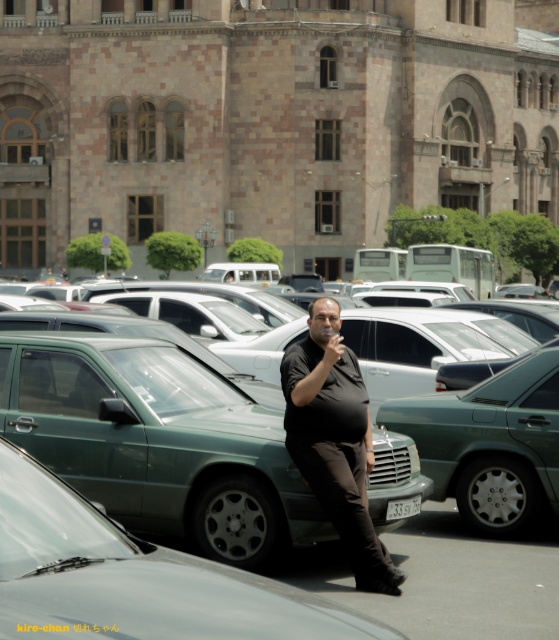
Question: Is black matte shirt at center positioned behind green matte car at center?

Choices:
 (A) yes
 (B) no

Answer: (A)

Question: Observing the image, what is the correct spatial positioning of black matte shirt at center in reference to green matte car at center?

Choices:
 (A) below
 (B) above

Answer: (A)

Question: Which point is farther from the camera taking this photo?

Choices:
 (A) (263, 401)
 (B) (381, 547)

Answer: (A)

Question: Which point is farther to the camera?

Choices:
 (A) green matte car at center
 (B) black matte shirt at center

Answer: (B)

Question: Observing the image, what is the correct spatial positioning of black matte shirt at center in reference to green matte car at center?

Choices:
 (A) right
 (B) left

Answer: (A)

Question: Among these objects, which one is farthest from the camera?

Choices:
 (A) black matte shirt at center
 (B) green matte car at center

Answer: (A)